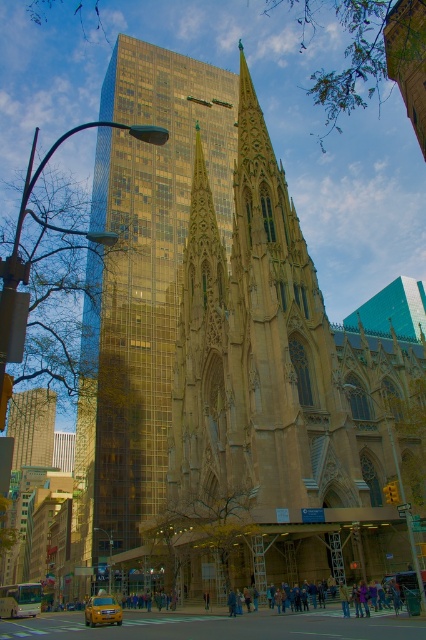
Question: Among these points, which one is farthest from the camera?

Choices:
 (A) (108, 618)
 (B) (25, 445)
 (C) (183, 129)
 (D) (420, 467)

Answer: (B)

Question: Which of these objects is positioned closest to the yellow matte taxi at lower center?

Choices:
 (A) gold glassy skyscraper at center
 (B) golden stone church at center

Answer: (B)

Question: Does golden stone church at center have a larger size compared to yellow matte taxi at lower center?

Choices:
 (A) no
 (B) yes

Answer: (B)

Question: Is golden stone church at center to the left of gold glassy skyscraper at center from the viewer's perspective?

Choices:
 (A) yes
 (B) no

Answer: (B)

Question: Can you confirm if golden stone church at center is positioned to the left of yellow matte taxi at lower center?

Choices:
 (A) yes
 (B) no

Answer: (B)

Question: Which of the following is the closest to the observer?

Choices:
 (A) yellow matte taxi at lower center
 (B) gold glass skyscraper at center
 (C) gold glassy skyscraper at center
 (D) golden stone church at center

Answer: (D)